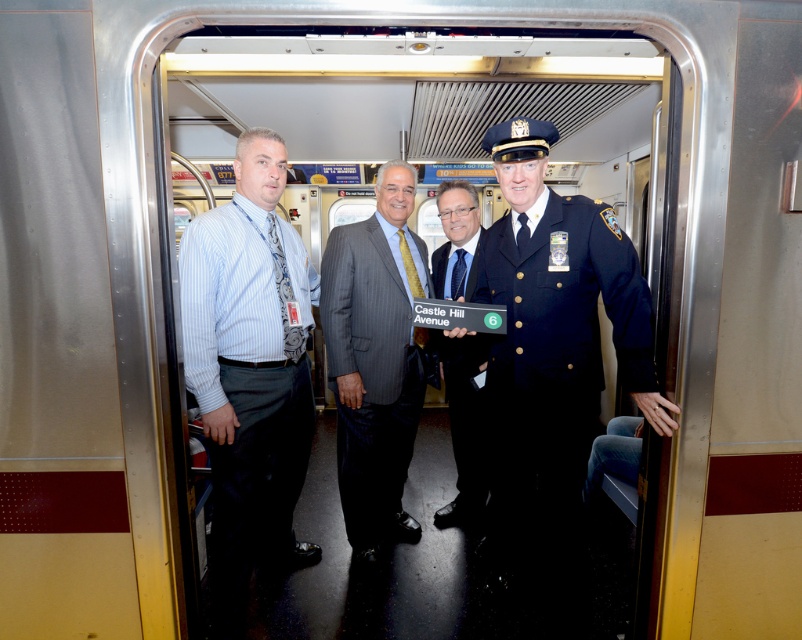
Question: Does light blue striped shirt at left appear on the right side of navy blue uniform at center?

Choices:
 (A) no
 (B) yes

Answer: (A)

Question: Which object is positioned farthest from the dark blue uniform at center?

Choices:
 (A) gray pinstripe suit at center
 (B) navy blue uniform at center
 (C) light blue striped shirt at left

Answer: (C)

Question: Which object is closer to the camera taking this photo?

Choices:
 (A) dark blue uniform at center
 (B) light blue striped shirt at left
 (C) navy blue uniform at center
 (D) gray pinstripe suit at center

Answer: (C)

Question: Observing the image, what is the correct spatial positioning of navy blue uniform at center in reference to gray pinstripe suit at center?

Choices:
 (A) right
 (B) left

Answer: (A)

Question: Among these objects, which one is farthest from the camera?

Choices:
 (A) navy blue uniform at center
 (B) gray pinstripe suit at center

Answer: (B)

Question: Does light blue striped shirt at left have a larger size compared to gray pinstripe suit at center?

Choices:
 (A) yes
 (B) no

Answer: (A)